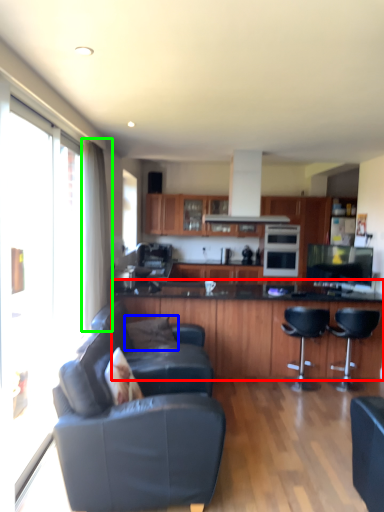
Question: Considering the real-world distances, which object is farthest from cabinetry (highlighted by a red box)? pillow (highlighted by a blue box) or curtain (highlighted by a green box)?

Choices:
 (A) pillow
 (B) curtain

Answer: (B)